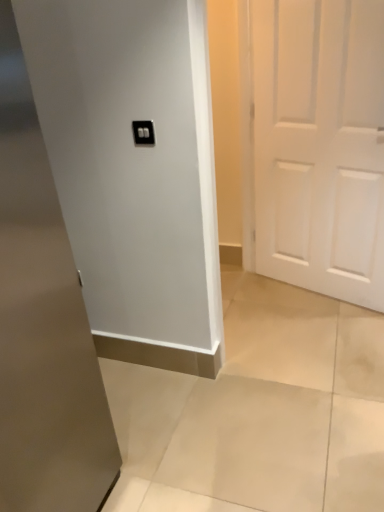
Locate an element on the screen. Image resolution: width=384 pixels, height=512 pixels. free point above beige polished concrete at lower center (from a real-world perspective) is located at coordinates (304, 370).